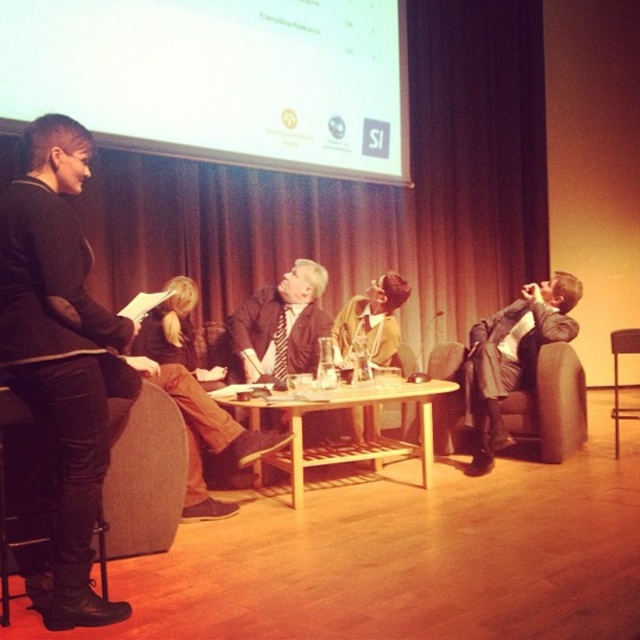
Question: Estimate the real-world distances between objects in this image. Which object is farther from the metallic silver chair at right?

Choices:
 (A) matte gray suit at right
 (B) woodenobject at center
 (C) brown leather jacket at center
 (D) light brown leather jacket at center

Answer: (C)

Question: Which is nearer to the matte gray suit at right?

Choices:
 (A) matte black suit at center
 (B) light brown leather jacket at center
 (C) woodenobject at center
 (D) white matte projection screen at upper center

Answer: (B)

Question: Considering the relative positions of matte gray suit at right and woodenobject at center in the image provided, where is matte gray suit at right located with respect to woodenobject at center?

Choices:
 (A) above
 (B) below

Answer: (A)

Question: Can you confirm if black leather pants at left is positioned to the right of matte black suit at center?

Choices:
 (A) yes
 (B) no

Answer: (B)

Question: Estimate the real-world distances between objects in this image. Which object is farther from the brown leather jacket at center?

Choices:
 (A) white matte projection screen at upper center
 (B) woodenobject at center

Answer: (A)

Question: Is black leather pants at left thinner than metallic silver chair at right?

Choices:
 (A) yes
 (B) no

Answer: (A)